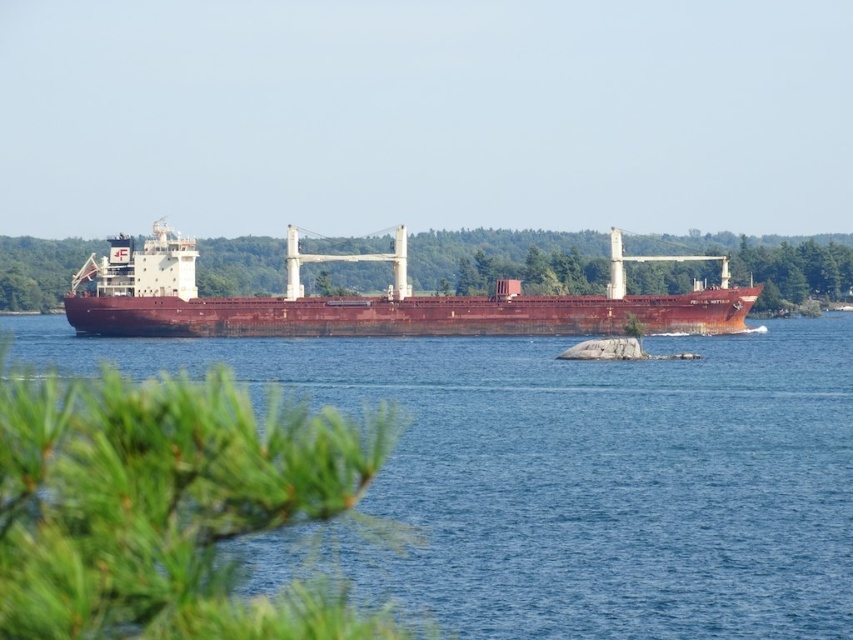
Question: Which point is farther from the camera taking this photo?

Choices:
 (A) (701, 520)
 (B) (218, 312)

Answer: (B)

Question: In this image, where is brown metallic water at center located relative to rusty metal ship at center?

Choices:
 (A) below
 (B) above

Answer: (A)

Question: Is brown metallic water at center closer to the viewer compared to rusty metal ship at center?

Choices:
 (A) no
 (B) yes

Answer: (B)

Question: Which of the following is the farthest from the observer?

Choices:
 (A) (526, 486)
 (B) (611, 243)

Answer: (B)

Question: Does brown metallic water at center have a greater width compared to rusty metal ship at center?

Choices:
 (A) no
 (B) yes

Answer: (B)